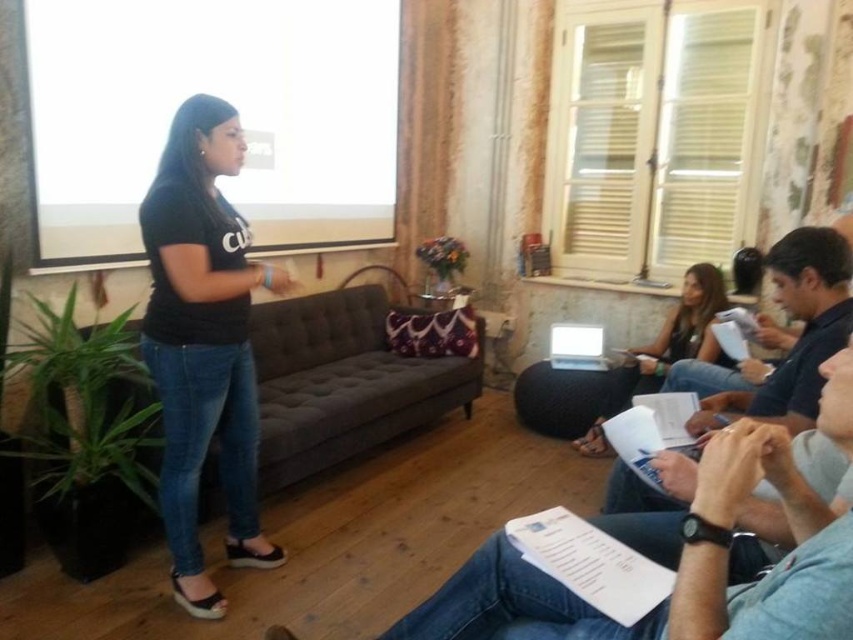
Consider the image. What is the color of the shirt worn by the person located at the coordinates point (802, 330) in the image?

The point (802, 330) marks the dark blue shirt at lower right, so the color is dark blue.

You are organizing a small event in this room and need to place a 1.2 meter wide banner between the black matte shirt at left and the matte black laptop at center. Is there enough space between them to fit the banner?

The black matte shirt at left has a smaller size compared to matte black laptop at center, but the spatial relationship between them isn not specified in terms of distance. Therefore, it is unclear if there is enough space to fit a 1.2 meter wide banner between them.

You are standing in the room and want to move from point A to point B. Point A is at coordinates point (173,522) and point B is at coordinates point (606,417). Which point is closer to you when you first enter the room?

Point (173,522) is closer to the viewer than point (606,417), so when you first enter the room, point A is closer to you.